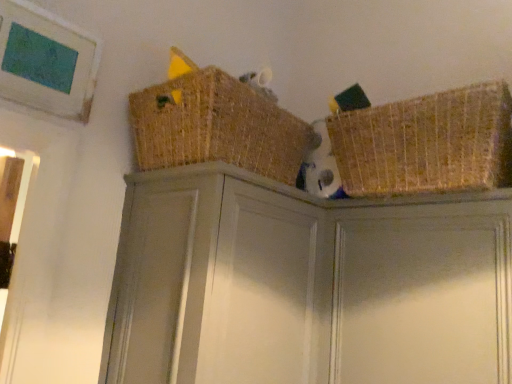
Question: Would you say matte gray cabinet at center is part of matte gray cabinet at upper right's contents?

Choices:
 (A) yes
 (B) no

Answer: (B)

Question: Does matte gray cabinet at upper right come behind matte gray cabinet at center?

Choices:
 (A) no
 (B) yes

Answer: (B)

Question: Does matte gray cabinet at upper right have a smaller size compared to matte gray cabinet at center?

Choices:
 (A) yes
 (B) no

Answer: (A)

Question: Would you say matte gray cabinet at upper right is outside matte gray cabinet at center?

Choices:
 (A) yes
 (B) no

Answer: (A)

Question: Considering the relative sizes of matte gray cabinet at upper right and matte gray cabinet at center in the image provided, is matte gray cabinet at upper right wider than matte gray cabinet at center?

Choices:
 (A) no
 (B) yes

Answer: (A)

Question: Is point (345, 157) positioned closer to the camera than point (280, 165)?

Choices:
 (A) farther
 (B) closer

Answer: (B)

Question: From a real-world perspective, is woven straw basket at upper right, the first basket viewed from the right, physically located above or below woven straw basket at upper center, the second basket in the right-to-left sequence?

Choices:
 (A) above
 (B) below

Answer: (B)

Question: Visually, is woven straw basket at upper right, the first basket viewed from the right, positioned to the left or to the right of woven straw basket at upper center, the 1th basket positioned from the left?

Choices:
 (A) right
 (B) left

Answer: (A)

Question: Is woven straw basket at upper right, the first basket viewed from the right, inside the boundaries of woven straw basket at upper center, the 1th basket positioned from the left, or outside?

Choices:
 (A) inside
 (B) outside

Answer: (B)

Question: From a real-world perspective, is matte gray cabinet at center above or below woven straw basket at upper right, which appears as the 2th basket when viewed from the left?

Choices:
 (A) below
 (B) above

Answer: (A)

Question: Is matte gray cabinet at center wider or thinner than woven straw basket at upper right, which appears as the 2th basket when viewed from the left?

Choices:
 (A) thin
 (B) wide

Answer: (B)

Question: Is point (289, 190) closer or farther from the camera than point (443, 152)?

Choices:
 (A) closer
 (B) farther

Answer: (B)

Question: In terms of size, does matte gray cabinet at center appear bigger or smaller than woven straw basket at upper right, the first basket viewed from the right?

Choices:
 (A) big
 (B) small

Answer: (A)

Question: Is point (202, 228) closer or farther from the camera than point (195, 127)?

Choices:
 (A) closer
 (B) farther

Answer: (A)

Question: Considering the positions of matte gray cabinet at center and woven straw basket at upper center, the second basket in the right-to-left sequence, in the image, is matte gray cabinet at center wider or thinner than woven straw basket at upper center, the second basket in the right-to-left sequence,?

Choices:
 (A) wide
 (B) thin

Answer: (A)